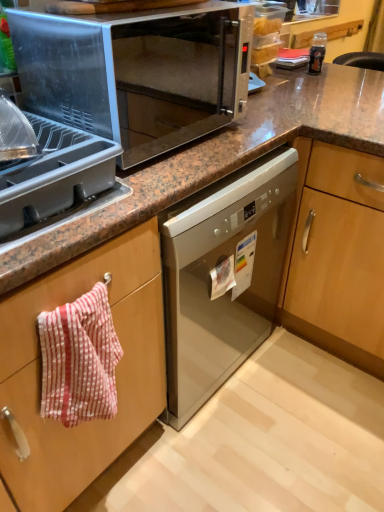
Question: Is the position of red striped towel at left more distant than that of satin silver microwave at upper center?

Choices:
 (A) yes
 (B) no

Answer: (B)

Question: Is red striped towel at left positioned before satin silver microwave at upper center?

Choices:
 (A) yes
 (B) no

Answer: (A)

Question: Does red striped towel at left have a lesser width compared to satin silver microwave at upper center?

Choices:
 (A) yes
 (B) no

Answer: (A)

Question: Is red striped towel at left to the right of satin silver microwave at upper center from the viewer's perspective?

Choices:
 (A) yes
 (B) no

Answer: (B)

Question: Is red striped towel at left not near satin silver microwave at upper center?

Choices:
 (A) yes
 (B) no

Answer: (B)

Question: From the image's perspective, would you say red striped towel at left is shown under satin silver microwave at upper center?

Choices:
 (A) no
 (B) yes

Answer: (B)

Question: From the image's perspective, would you say gray plastic tray at upper left is shown under satin silver microwave at upper center?

Choices:
 (A) yes
 (B) no

Answer: (A)

Question: Is gray plastic tray at upper left closer to camera compared to satin silver microwave at upper center?

Choices:
 (A) no
 (B) yes

Answer: (B)

Question: From a real-world perspective, is gray plastic tray at upper left on top of satin silver microwave at upper center?

Choices:
 (A) yes
 (B) no

Answer: (B)

Question: Is gray plastic tray at upper left at the right side of satin silver microwave at upper center?

Choices:
 (A) yes
 (B) no

Answer: (B)

Question: From a real-world perspective, is gray plastic tray at upper left physically below satin silver microwave at upper center?

Choices:
 (A) yes
 (B) no

Answer: (A)

Question: Can you confirm if gray plastic tray at upper left is taller than satin silver microwave at upper center?

Choices:
 (A) no
 (B) yes

Answer: (A)

Question: Is red striped towel at left shorter than gray plastic tray at upper left?

Choices:
 (A) no
 (B) yes

Answer: (A)